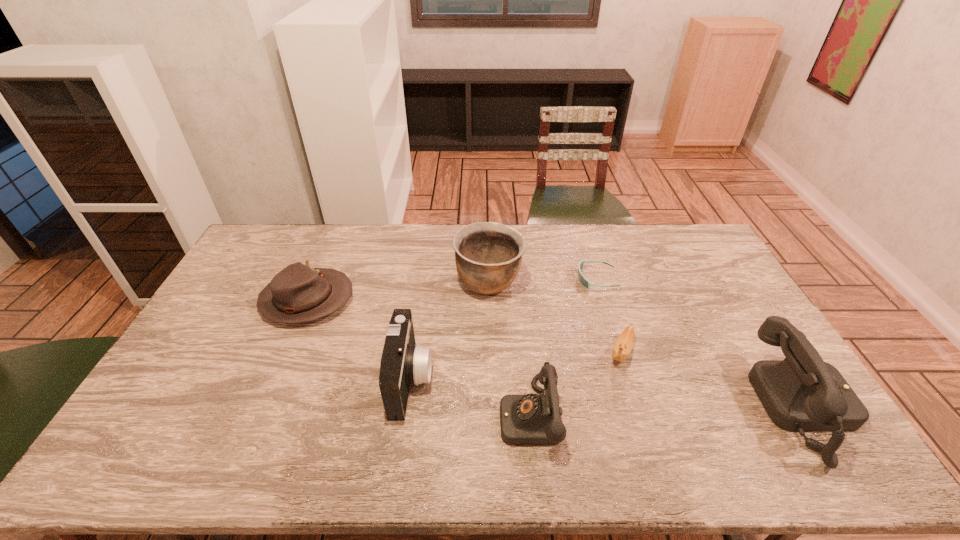
Locate an element on the screen. object located in the far edge section of the desktop is located at coordinates (488, 255).

This screenshot has height=540, width=960. What are the coordinates of `camcorder located at the near edge` in the screenshot? It's located at (403, 363).

Find the location of a particular element. The height and width of the screenshot is (540, 960). object present at the left edge is located at coordinates (297, 294).

This screenshot has width=960, height=540. Identify the location of object present at the right edge. (801, 393).

Locate an element on the screen. object that is at the near right corner is located at coordinates (801, 393).

Image resolution: width=960 pixels, height=540 pixels. I want to click on free location at the far edge of the desktop, so click(341, 256).

Identify the location of vacant area at the near edge of the desktop. This screenshot has width=960, height=540. (340, 420).

In the image, there is a desktop. Where is `free space at the left edge`? The image size is (960, 540). free space at the left edge is located at coordinates click(x=247, y=288).

The height and width of the screenshot is (540, 960). Identify the location of vacant space at the right edge of the desktop. (718, 281).

The height and width of the screenshot is (540, 960). Find the location of `free location at the near left corner`. free location at the near left corner is located at coordinates (163, 425).